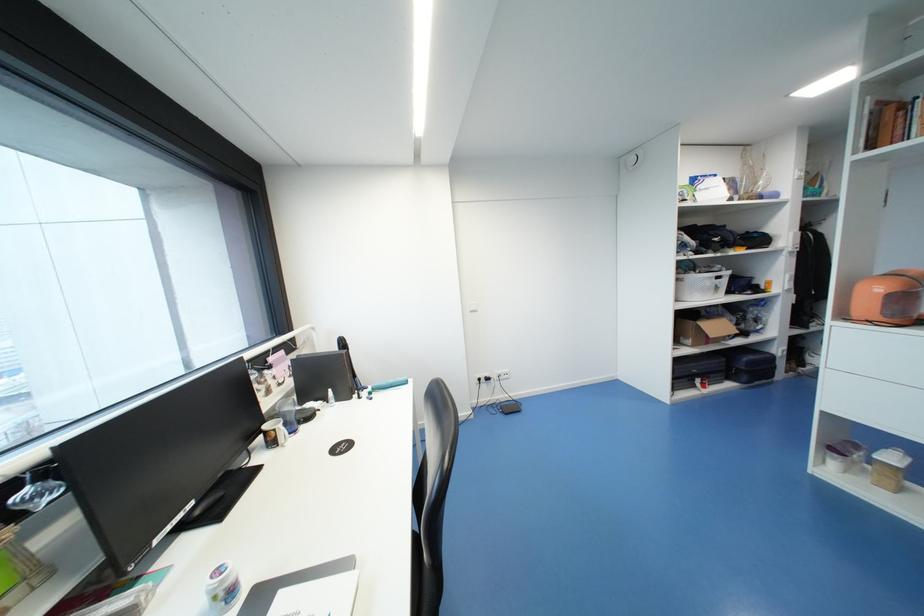
The image size is (924, 616). What do you see at coordinates (881, 361) in the screenshot?
I see `the white drawer front` at bounding box center [881, 361].